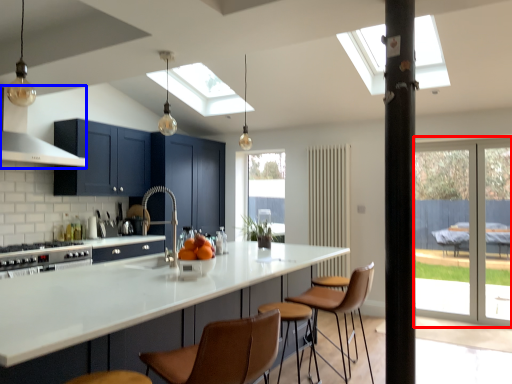
Question: Which point is closer to the camera, screen door (highlighted by a red box) or exhaust hood (highlighted by a blue box)?

Choices:
 (A) screen door
 (B) exhaust hood

Answer: (B)